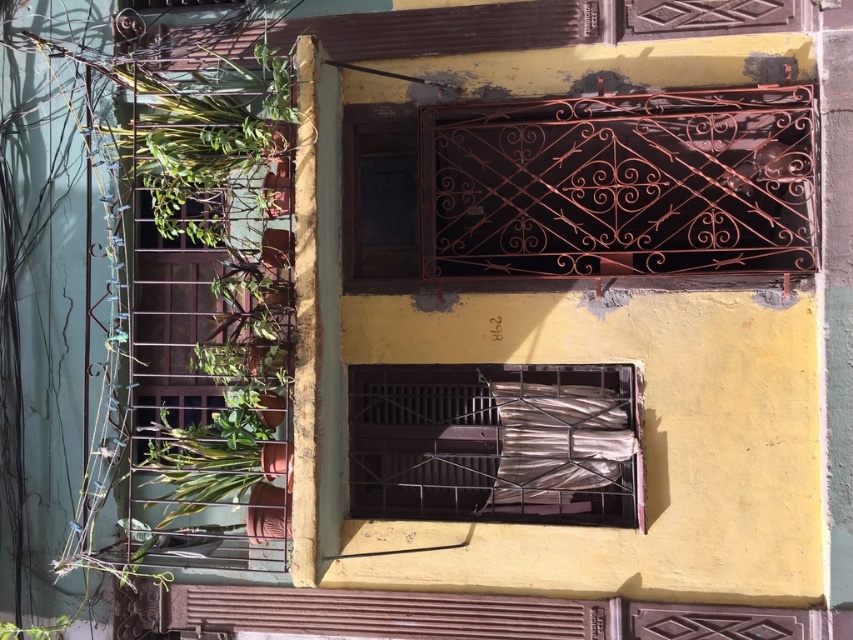
Question: Does brown matte window at center appear under rusty metal shutter at lower center?

Choices:
 (A) no
 (B) yes

Answer: (A)

Question: Does rusty metal gate at upper center appear on the right side of brown matte window at center?

Choices:
 (A) no
 (B) yes

Answer: (B)

Question: Can you confirm if rusty metal gate at upper center is positioned to the left of brown matte window at center?

Choices:
 (A) yes
 (B) no

Answer: (B)

Question: Which of the following is the farthest from the observer?

Choices:
 (A) rusty metal gate at upper center
 (B) brown matte window at center

Answer: (B)

Question: Which point is closer to the camera taking this photo?

Choices:
 (A) (480, 125)
 (B) (300, 621)

Answer: (A)

Question: Which of the following is the closest to the observer?

Choices:
 (A) (280, 600)
 (B) (529, 156)
 (C) (416, 454)

Answer: (B)